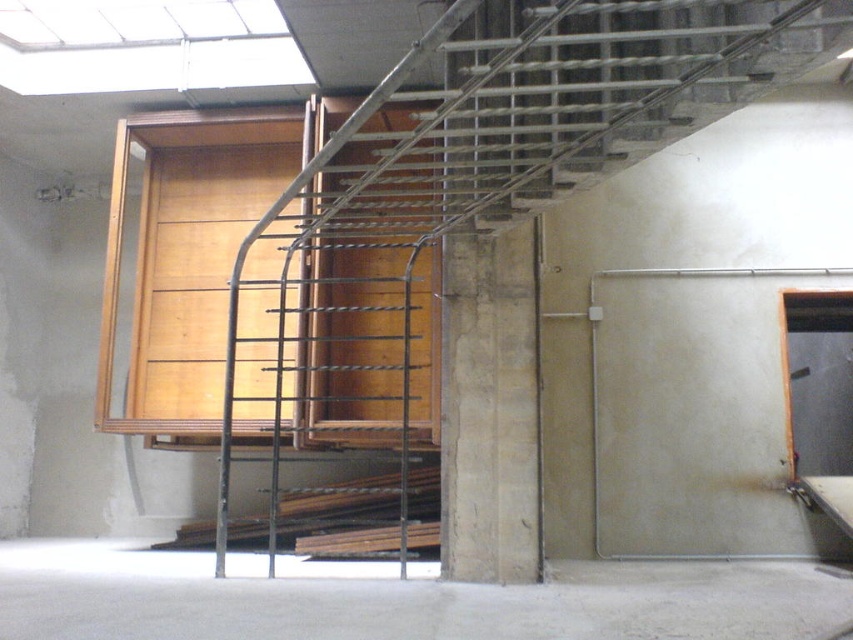
Based on the photo, you are a construction worker standing on the concrete floor at lower center. You need to reach the ceiling beams to install a light fixture. The metallic gray ladder at center is available. Is the ladder tall enough to reach the ceiling beams?

The metallic gray ladder at center is 2.61 meters away from the concrete floor at lower center. Assuming the ladder is placed vertically, its height would need to be at least 2.61 meters to reach the ceiling beams. However, ladders typically require some clearance at the top for safety, so the ladder may need to be slightly taller than 2.61 meters to safely reach the ceiling beams.

You are a construction worker standing at the entrance of the room. You need to reach the ceiling grid to install a light fixture. Which object, the metallic gray ladder at center or the concrete floor at lower center, is positioned closer to where you are standing?

The metallic gray ladder at center is closer to the viewer than the concrete floor at lower center, so the ladder is positioned closer to where you are standing.